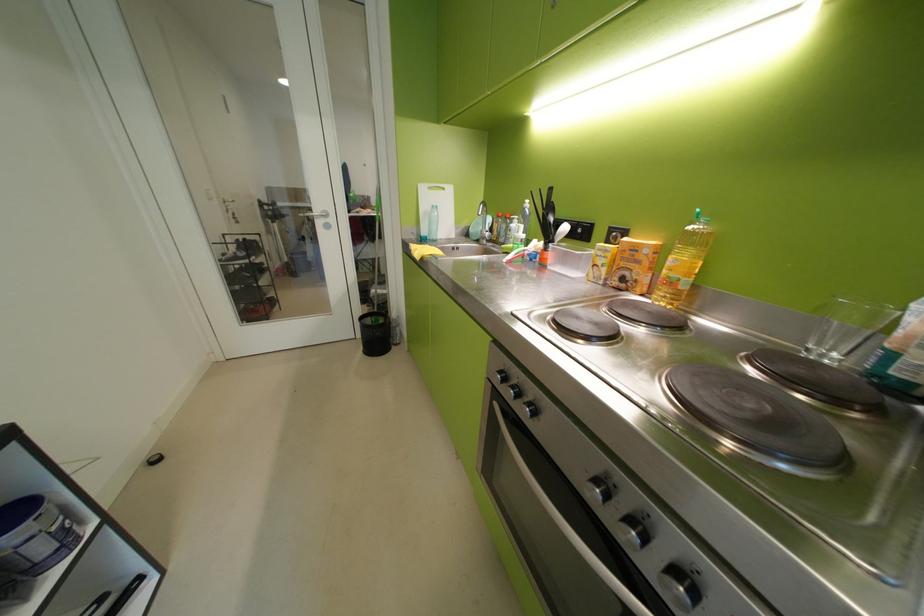
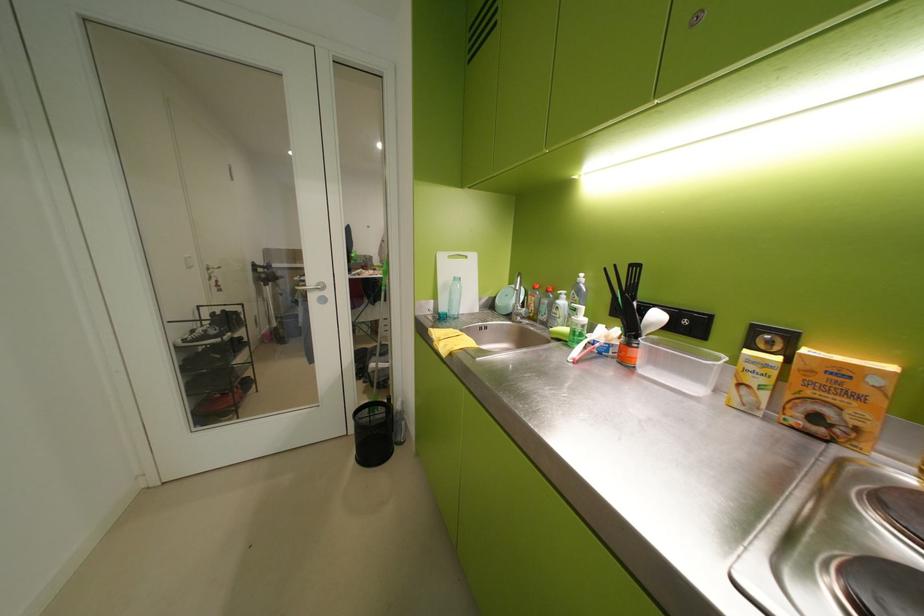
Locate, in the second image, the point that corresponds to (x=433, y=233) in the first image.

(453, 310)